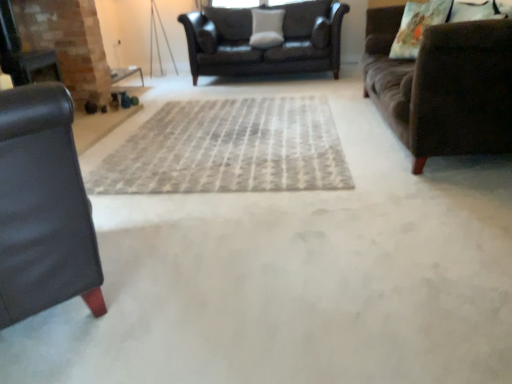
Locate an element on the screen. vacant area that lies to the right of black leather couch at left, the 3th studio couch when ordered from back to front is located at coordinates (203, 271).